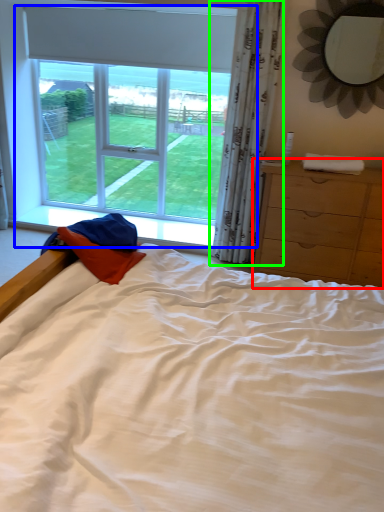
Question: Based on their relative distances, which object is nearer to chest of drawers (highlighted by a red box)? Choose from window (highlighted by a blue box) and curtain (highlighted by a green box).

Choices:
 (A) window
 (B) curtain

Answer: (B)